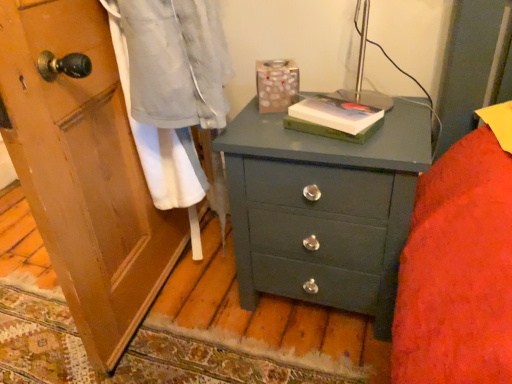
Find the location of a particular element. This screenshot has width=512, height=384. free spot to the left of hardcover book at center, marked as the 1th book in a bottom-to-top arrangement is located at coordinates (272, 127).